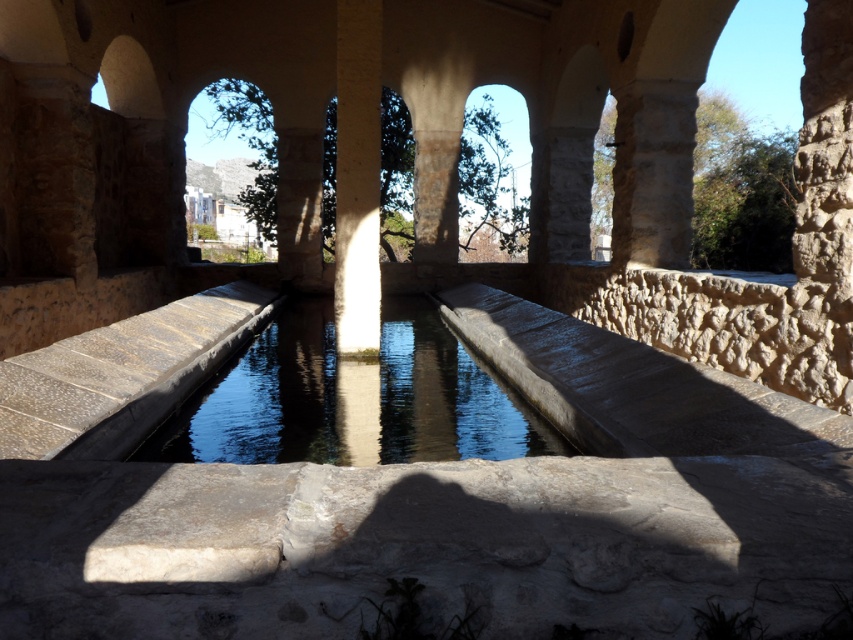
Does clear stone water at center have a greater height compared to white stone pillar at center?

Incorrect, clear stone water at center's height is not larger of white stone pillar at center's.

Is point (541, 448) farther from camera compared to point (347, 76)?

No, (541, 448) is closer to viewer.

You are a GUI agent. You are given a task and a screenshot of the screen. Output one action in this format:
    pyautogui.click(x=<x>, y=<y>)
    Task: Click on the clear stone water at center
    Image resolution: width=853 pixels, height=640 pixels.
    Given the screenshot: What is the action you would take?
    pyautogui.click(x=352, y=397)

Identify the location of clear stone water at center. The height and width of the screenshot is (640, 853). (352, 397).